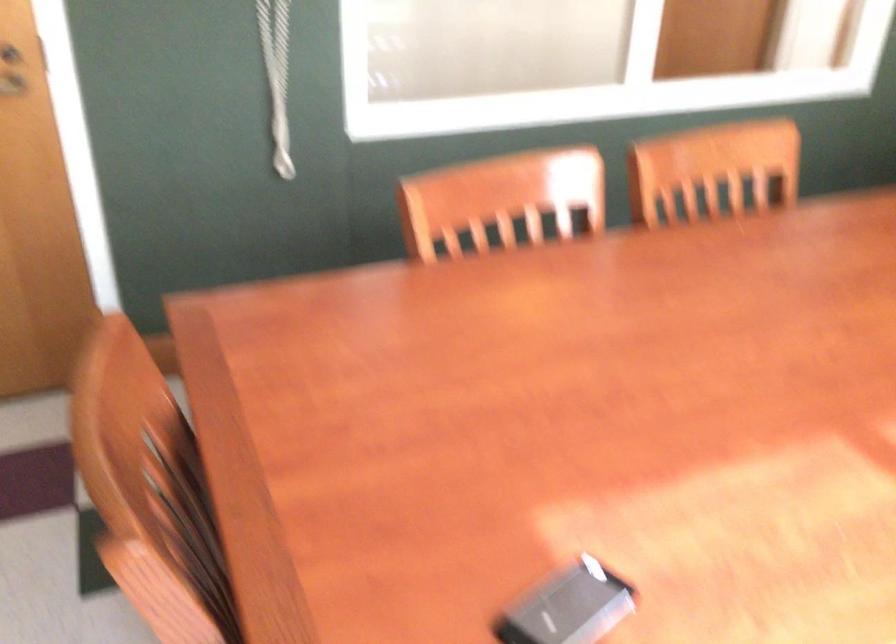
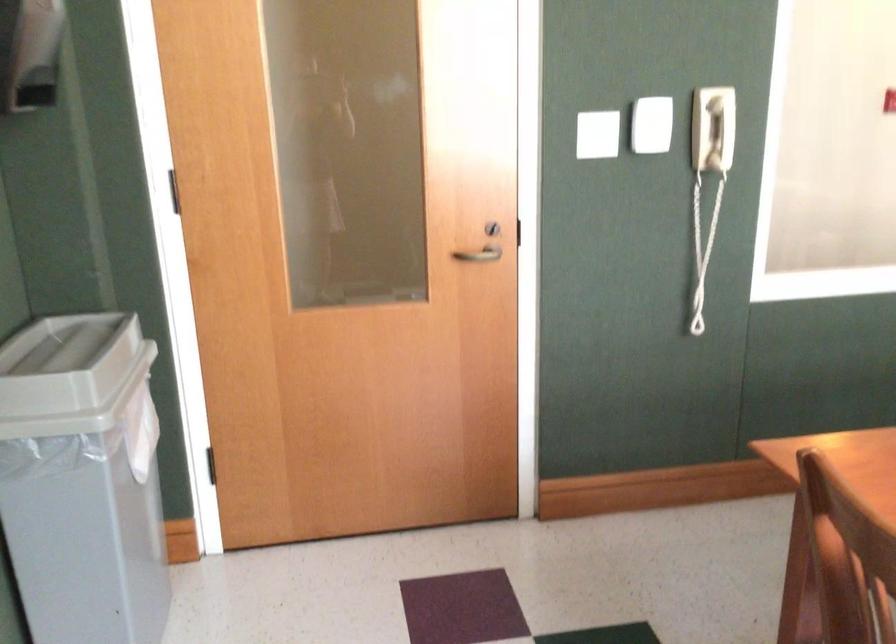
Question: The images are taken continuously from a first-person perspective. In which direction is your viewpoint rotating?

Choices:
 (A) Left
 (B) Right
 (C) Up
 (D) Down

Answer: (A)